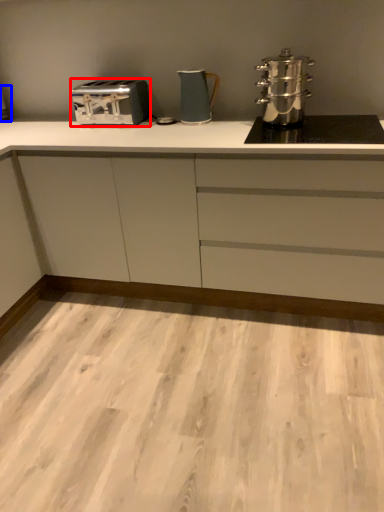
Question: Which point is closer to the camera, toaster (highlighted by a red box) or appliance (highlighted by a blue box)?

Choices:
 (A) toaster
 (B) appliance

Answer: (A)